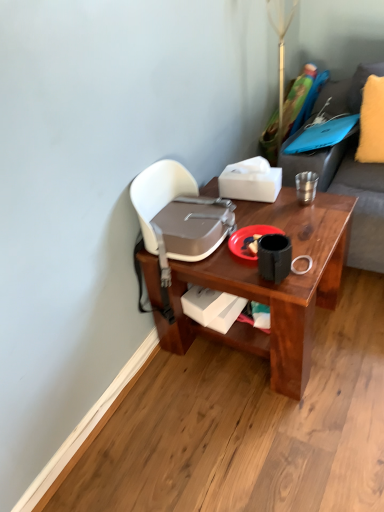
Question: Is white matte tissue box at upper center, positioned as the 1th box in top-to-bottom order, inside or outside of metallic pole at upper center?

Choices:
 (A) inside
 (B) outside

Answer: (B)

Question: From a real-world perspective, is white matte tissue box at upper center, which ranks as the 2th box in bottom-to-top order, physically located above or below metallic pole at upper center?

Choices:
 (A) below
 (B) above

Answer: (A)

Question: Which is nearer to the yellow fuzzy pillow at upper right?

Choices:
 (A) metallic silver coffee cup at upper right
 (B) red matte plate at center
 (C) brown wood desk at center
 (D) white matte box at lower center, the 1th box when ordered from bottom to top
 (E) white matte tissue box at upper center, which ranks as the 2th box in bottom-to-top order

Answer: (A)

Question: Which is farther from the brown wood desk at center?

Choices:
 (A) metallic silver coffee cup at upper right
 (B) red matte plate at center
 (C) white matte tissue box at upper center, positioned as the 1th box in top-to-bottom order
 (D) white matte box at lower center, the 1th box when ordered from bottom to top
 (E) yellow fuzzy pillow at upper right

Answer: (E)